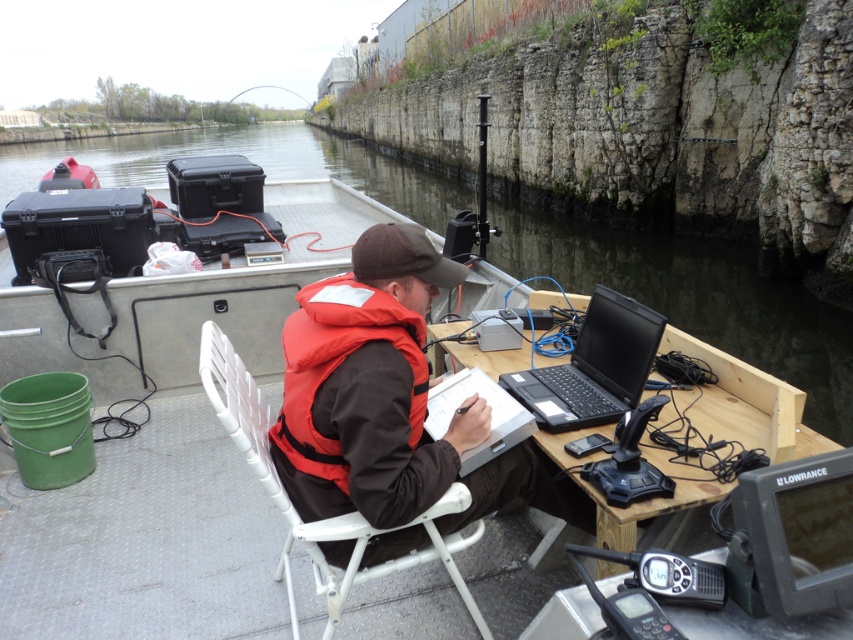
Between point (833, 435) and point (370, 260), which one is positioned in front?

Positioned in front is point (370, 260).

Is clear water at boat center positioned before orange life vest at center?

No.

What do you see at coordinates (695, 298) in the screenshot?
I see `clear water at boat center` at bounding box center [695, 298].

Identify the location of clear water at boat center. (695, 298).

Can you confirm if white plastic chair at center is thinner than black matte laptop at center?

No.

Is point (305, 525) positioned before point (552, 371)?

Yes, it is in front of point (552, 371).

Locate an element on the screen. The image size is (853, 640). white plastic chair at center is located at coordinates (325, 518).

From the picture: Does orange life vest at center have a lesser width compared to black matte laptop at center?

No, orange life vest at center is not thinner than black matte laptop at center.

Does orange life vest at center have a larger size compared to black matte laptop at center?

Indeed, orange life vest at center has a larger size compared to black matte laptop at center.

At what (x,y) coordinates should I click in order to perform the action: click on orange life vest at center. Please return your answer as a coordinate pair (x, y). This screenshot has height=640, width=853. Looking at the image, I should click on (368, 387).